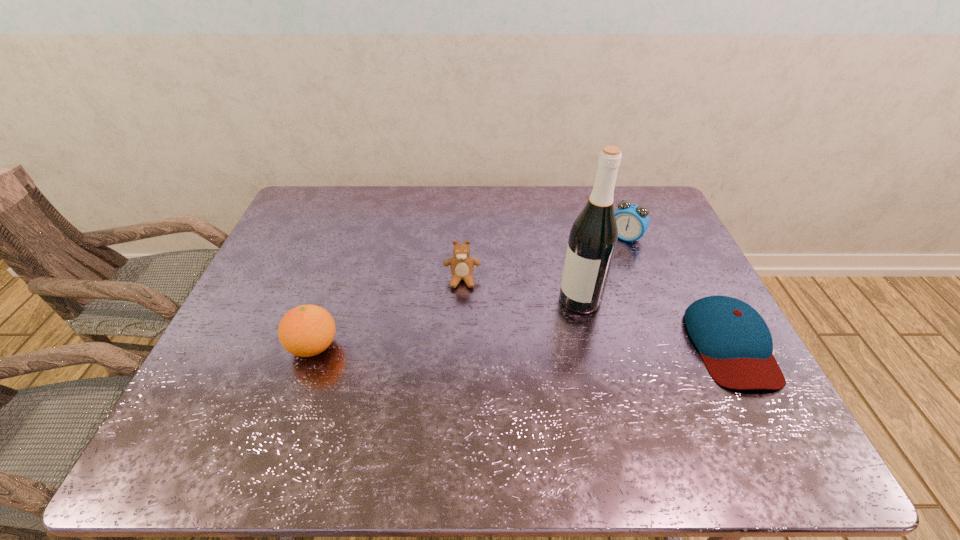
Locate an element on the screen. This screenshot has height=540, width=960. free space on the desktop that is between the orange and the rightmost object and is positioned on the face of the farthest object is located at coordinates (546, 345).

Identify the location of vacant spot on the desktop that is between the leftmost object and the rightmost object and is positioned on the label of the wine bottle. Image resolution: width=960 pixels, height=540 pixels. (532, 346).

Locate an element on the screen. vacant space on the desktop that is between the leftmost object and the rightmost object and is positioned on the front-facing side of the teddy bear is located at coordinates (461, 346).